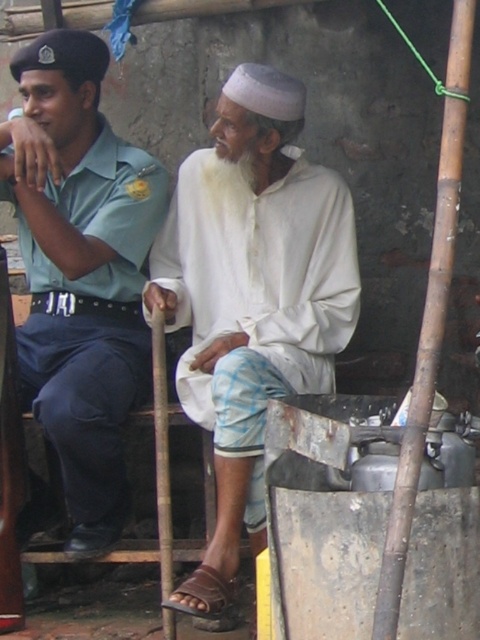
You are standing in front of the image and want to locate the green uniform at left. According to the coordinates provided, where exactly is it positioned?

The green uniform at left is located at point coordinates (81, 272).

You are a photographer trying to capture a clear photo of both the green uniform at left and the brown leather sandal at lower center. Considering their sizes, which object should you focus on first to ensure it appears sharp in the photo?

The green uniform at left is larger than the brown leather sandal at lower center, so you should focus on the green uniform at left first to ensure it appears sharp in the photo.

You are a photographer setting up for a group photo. You need to ensure that the green uniform at left is visible above the white matte cloth at center. Based on the scene description, is this possible?

The white matte cloth at center is positioned under the green uniform at left, so yes, the green uniform at left is visible above the white matte cloth at center.